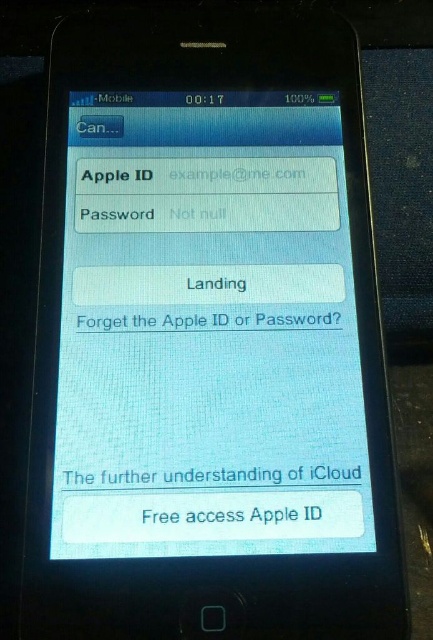
Is white glossy screen at center to the left of white matte text at bottom from the viewer's perspective?

Correct, you'll find white glossy screen at center to the left of white matte text at bottom.

Does white glossy screen at center have a smaller size compared to white matte text at bottom?

No.

Is point (99, 104) behind point (171, 538)?

Yes.

This screenshot has width=433, height=640. I want to click on white glossy screen at center, so click(207, 332).

How much distance is there between white glossy screen at center and white paper text at center?

A distance of 6.02 inches exists between white glossy screen at center and white paper text at center.

Describe the element at coordinates (207, 332) in the screenshot. I see `white glossy screen at center` at that location.

Find the location of `white glossy screen at center`. white glossy screen at center is located at coordinates [207, 332].

From the picture: Does white matte text at bottom have a lesser width compared to white paper text at center?

No.

Consider the image. Can you confirm if white matte text at bottom is positioned below white paper text at center?

Correct, white matte text at bottom is located below white paper text at center.

Image resolution: width=433 pixels, height=640 pixels. I want to click on white matte text at bottom, so click(210, 515).